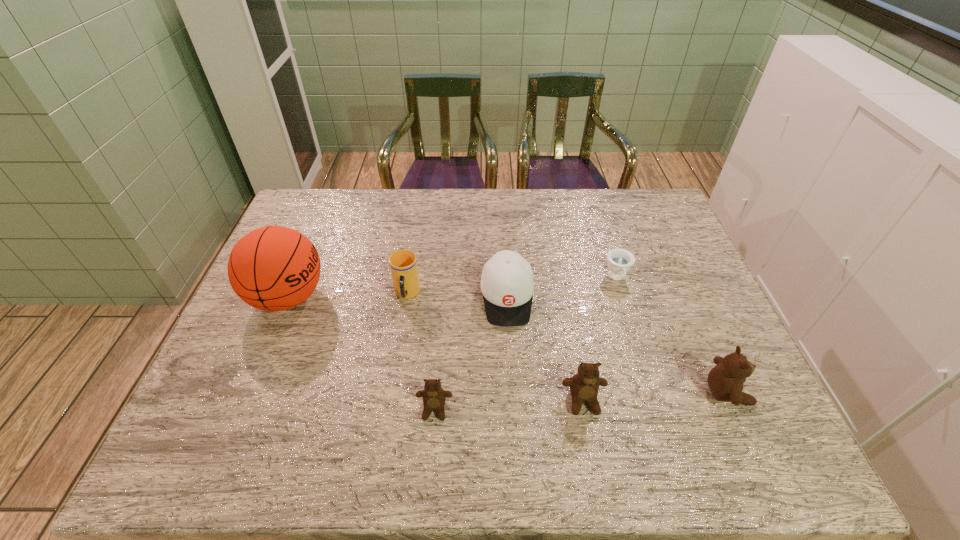
The height and width of the screenshot is (540, 960). Find the location of `the tallest object`. the tallest object is located at coordinates (274, 268).

The height and width of the screenshot is (540, 960). In order to click on baseball cap in this screenshot , I will do `click(507, 284)`.

Identify the location of vacant space located on the side of the cup with the handle. The width and height of the screenshot is (960, 540). (396, 367).

This screenshot has height=540, width=960. In order to click on free space located on the side of the teacup with the handle in this screenshot , I will do `click(649, 382)`.

At what (x,y) coordinates should I click in order to perform the action: click on free space located 0.270m on the side with logo of the tallest object. Please return your answer as a coordinate pair (x, y). The height and width of the screenshot is (540, 960). Looking at the image, I should click on (423, 298).

Locate an element on the screen. The image size is (960, 540). free space located 0.180m on the front-facing side of the baseball cap is located at coordinates coord(513,389).

The width and height of the screenshot is (960, 540). Identify the location of object that is at the left edge. (274, 268).

In order to click on object that is at the right edge in this screenshot , I will do `click(725, 380)`.

Image resolution: width=960 pixels, height=540 pixels. Identify the location of object that is at the near right corner. (725, 380).

Locate an element on the screen. free space at the far edge of the desktop is located at coordinates (406, 207).